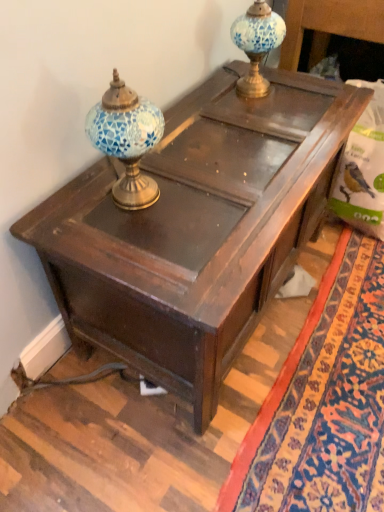
Question: From the image's perspective, does blue mosaic glass lamp at upper center, acting as the 2th candle holder starting from the bottom, appear higher than wooden table at center?

Choices:
 (A) no
 (B) yes

Answer: (B)

Question: From a real-world perspective, is blue mosaic glass lamp at upper center, placed as the second candle holder when sorted from left to right, below wooden table at center?

Choices:
 (A) yes
 (B) no

Answer: (B)

Question: Considering the relative sizes of blue mosaic glass lamp at upper center, the first candle holder when ordered from right to left, and wooden table at center in the image provided, is blue mosaic glass lamp at upper center, the first candle holder when ordered from right to left, bigger than wooden table at center?

Choices:
 (A) no
 (B) yes

Answer: (A)

Question: Can you confirm if blue mosaic glass lamp at upper center, acting as the 1th candle holder starting from the back, is positioned to the right of wooden table at center?

Choices:
 (A) no
 (B) yes

Answer: (B)

Question: Is blue mosaic glass lamp at upper center, the 2th candle holder viewed from the front, next to wooden table at center?

Choices:
 (A) no
 (B) yes

Answer: (A)

Question: From a real-world perspective, is blue mosaic glass lamp at upper left, the 2th candle holder from the back, physically located above or below wooden table at center?

Choices:
 (A) below
 (B) above

Answer: (B)

Question: Looking at the image, does blue mosaic glass lamp at upper left, placed as the first candle holder when sorted from bottom to top, seem bigger or smaller compared to wooden table at center?

Choices:
 (A) small
 (B) big

Answer: (A)

Question: Is point (135, 129) closer or farther from the camera than point (316, 135)?

Choices:
 (A) closer
 (B) farther

Answer: (A)

Question: Considering the relative positions of blue mosaic glass lamp at upper left, the first candle holder in the front-to-back sequence, and wooden table at center in the image provided, is blue mosaic glass lamp at upper left, the first candle holder in the front-to-back sequence, to the left or to the right of wooden table at center?

Choices:
 (A) right
 (B) left

Answer: (B)

Question: In the image, is blue mosaic glass lamp at upper center, the first candle holder positioned from the top, on the left side or the right side of blue mosaic glass lamp at upper left, which is counted as the 2th candle holder, starting from the right?

Choices:
 (A) left
 (B) right

Answer: (B)

Question: Do you think blue mosaic glass lamp at upper center, placed as the second candle holder when sorted from left to right, is within blue mosaic glass lamp at upper left, the first candle holder viewed from the left, or outside of it?

Choices:
 (A) outside
 (B) inside

Answer: (A)

Question: In terms of height, does blue mosaic glass lamp at upper center, placed as the second candle holder when sorted from left to right, look taller or shorter compared to blue mosaic glass lamp at upper left, which ranks as the second candle holder in top-to-bottom order?

Choices:
 (A) short
 (B) tall

Answer: (A)

Question: Based on their sizes in the image, would you say blue mosaic glass lamp at upper center, acting as the 2th candle holder starting from the bottom, is bigger or smaller than blue mosaic glass lamp at upper left, which ranks as the second candle holder in top-to-bottom order?

Choices:
 (A) big
 (B) small

Answer: (B)

Question: In terms of height, does wooden table at center look taller or shorter compared to blue mosaic glass lamp at upper center, acting as the 2th candle holder starting from the bottom?

Choices:
 (A) tall
 (B) short

Answer: (A)

Question: From the image's perspective, is wooden table at center positioned above or below blue mosaic glass lamp at upper center, the first candle holder positioned from the top?

Choices:
 (A) below
 (B) above

Answer: (A)